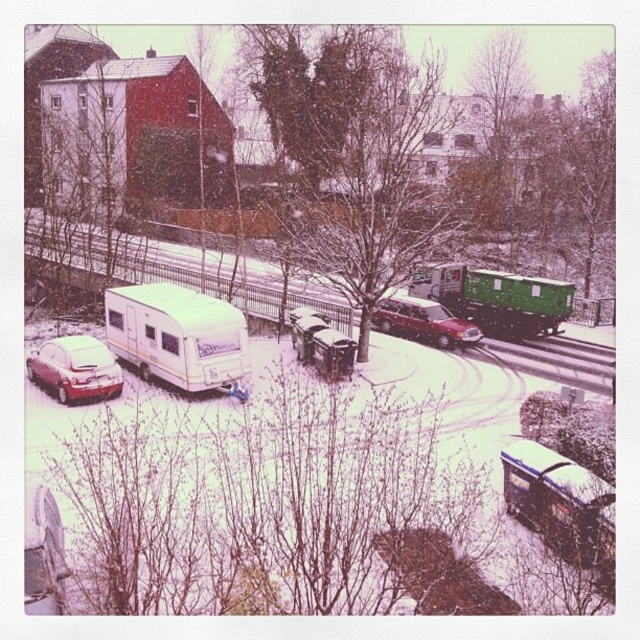
You are standing at the point with coordinates point (90, 371) in this snowy urban scene. If you want to take a photo of the entire scene from your current position, will the camera need to have a wide angle lens? Please explain your reasoning based on the distance between you and the camera.

The point point (90, 371) and camera are 20.85 meters apart. Since the camera is 20.85 meters away from the point, a wide angle lens would be necessary to capture the entire scene from that distance.

You are a delivery person needing to load a tall package onto either the green matte trailer at center or the matte red car at lower left. Which vehicle should you choose based on their heights?

The green matte trailer at center has a greater height compared to the matte red car at lower left, so you should choose the green matte trailer at center to load the tall package.

You are a delivery driver who needs to park your delivery van between the metallic silver trailer at lower right and the matte red car at lower left. The van is 20 feet long. Can you fit the van between them without overlapping either vehicle?

The metallic silver trailer at lower right is 49.38 feet away from the matte red car at lower left. Since the van is only 20 feet long, there is sufficient space between them to park the van without overlapping either vehicle.